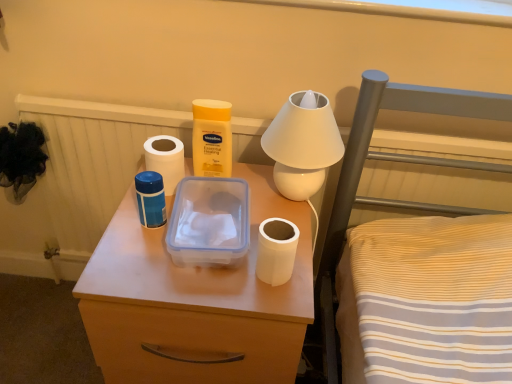
Locate an element on the screen. This screenshot has height=384, width=512. vacant area on top of matte plastic container at center (from a real-world perspective) is located at coordinates (198, 220).